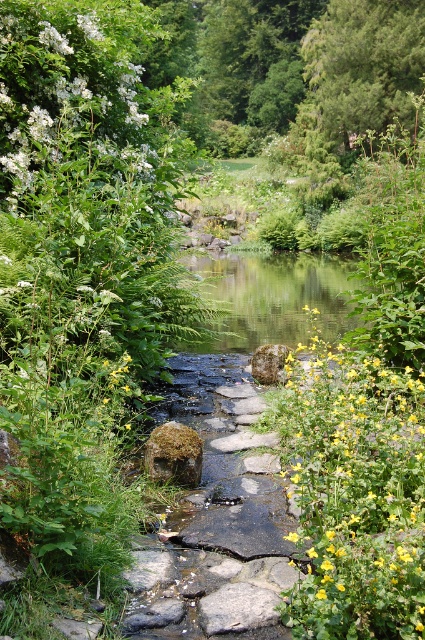
You are standing at the point marked by point (354, 493) in the scene. Looking around, you see a dense cluster of white flowers on the left side of the stream and yellow flowers on the right side. Which direction should you walk to reach the yellow flowers?

You are already at the yellow flowers at center right, so you don not need to move.